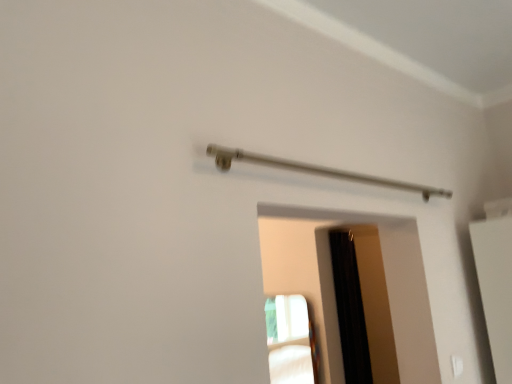
Describe the element at coordinates (291, 341) in the screenshot. This screenshot has height=384, width=512. I see `white glossy mirror at upper center` at that location.

Locate an element on the screen. The width and height of the screenshot is (512, 384). white glossy mirror at upper center is located at coordinates (291, 341).

In order to face white glossy mirror at upper center, should I rotate leftwards or rightwards?

You should rotate right by 2.545 degrees.

The height and width of the screenshot is (384, 512). Identify the location of white glossy mirror at upper center. (291, 341).